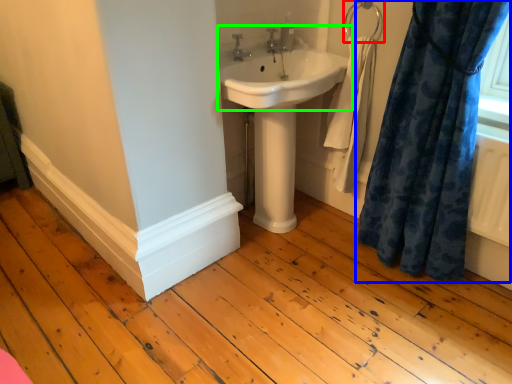
Question: Which object is the closest to the towel bar (highlighted by a red box)? Choose among these: curtain (highlighted by a blue box) or sink (highlighted by a green box).

Choices:
 (A) curtain
 (B) sink

Answer: (B)